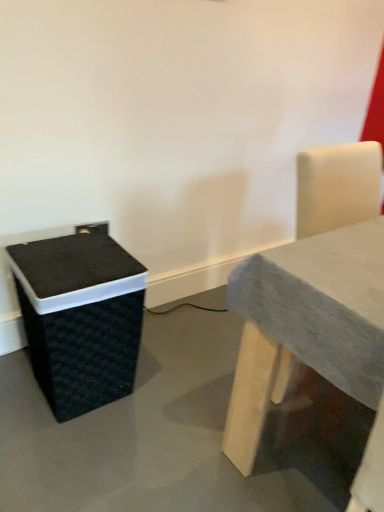
Question: Is gray fabric table at right smaller than black woven basket at lower left?

Choices:
 (A) yes
 (B) no

Answer: (B)

Question: Is gray fabric table at right aimed at black woven basket at lower left?

Choices:
 (A) no
 (B) yes

Answer: (A)

Question: Can you confirm if gray fabric table at right is wider than black woven basket at lower left?

Choices:
 (A) yes
 (B) no

Answer: (A)

Question: Does gray fabric table at right appear on the left side of black woven basket at lower left?

Choices:
 (A) yes
 (B) no

Answer: (B)

Question: Can black woven basket at lower left be found inside gray fabric table at right?

Choices:
 (A) yes
 (B) no

Answer: (B)

Question: From a real-world perspective, is gray fabric table at right below black woven basket at lower left?

Choices:
 (A) yes
 (B) no

Answer: (B)

Question: Is black woven basket at lower left facing towards gray fabric table at right?

Choices:
 (A) no
 (B) yes

Answer: (A)

Question: Considering the relative positions of black woven basket at lower left and gray fabric table at right in the image provided, is black woven basket at lower left in front of gray fabric table at right?

Choices:
 (A) no
 (B) yes

Answer: (A)

Question: Is black woven basket at lower left not near gray fabric table at right?

Choices:
 (A) yes
 (B) no

Answer: (B)

Question: Is black woven basket at lower left behind gray fabric table at right?

Choices:
 (A) yes
 (B) no

Answer: (A)

Question: From a real-world perspective, is black woven basket at lower left under gray fabric table at right?

Choices:
 (A) no
 (B) yes

Answer: (B)

Question: From the image's perspective, is black woven basket at lower left located above gray fabric table at right?

Choices:
 (A) yes
 (B) no

Answer: (B)

Question: Based on their sizes in the image, would you say black woven basket at lower left is bigger or smaller than gray fabric table at right?

Choices:
 (A) big
 (B) small

Answer: (B)